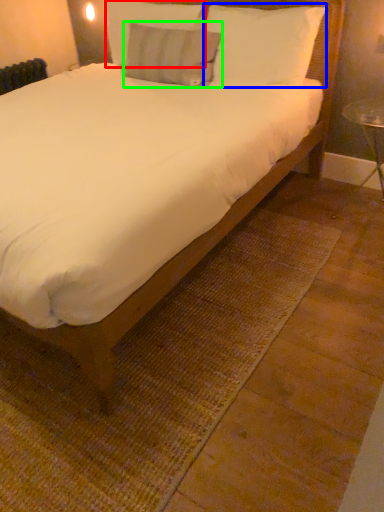
Question: Estimate the real-world distances between objects in this image. Which object is closer to pillow (highlighted by a red box), pillow (highlighted by a blue box) or pillow (highlighted by a green box)?

Choices:
 (A) pillow
 (B) pillow

Answer: (B)